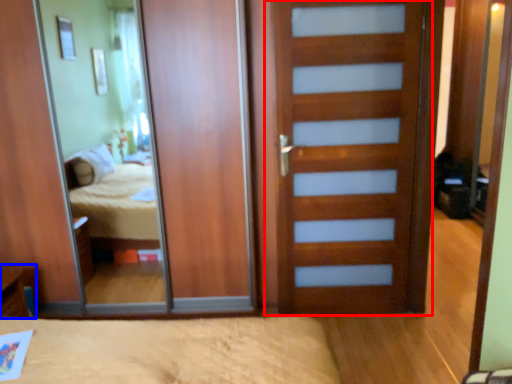
Question: Which object appears closest to the camera in this image, door (highlighted by a red box) or table (highlighted by a blue box)?

Choices:
 (A) door
 (B) table

Answer: (A)